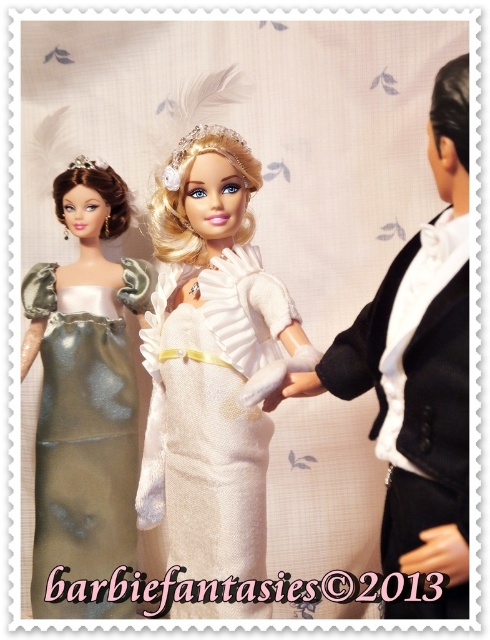
Question: Among these points, which one is nearest to the camera?

Choices:
 (A) (463, 579)
 (B) (304, 390)

Answer: (A)

Question: Can you confirm if white lace dress at center is positioned below white textured dress at center?

Choices:
 (A) no
 (B) yes

Answer: (A)

Question: Which of the following is the closest to the observer?

Choices:
 (A) (437, 528)
 (B) (241, 433)
 (C) (425, 376)
 (D) (104, 353)

Answer: (A)

Question: Is white lace dress at center further to the viewer compared to matte black hand at lower right?

Choices:
 (A) yes
 (B) no

Answer: (A)

Question: Considering the real-world distances, which object is farthest from the satin metallic dress at left?

Choices:
 (A) matte black hand at lower right
 (B) white lace dress at center

Answer: (A)

Question: Does white lace dress at center appear under matte black hand at lower right?

Choices:
 (A) yes
 (B) no

Answer: (B)